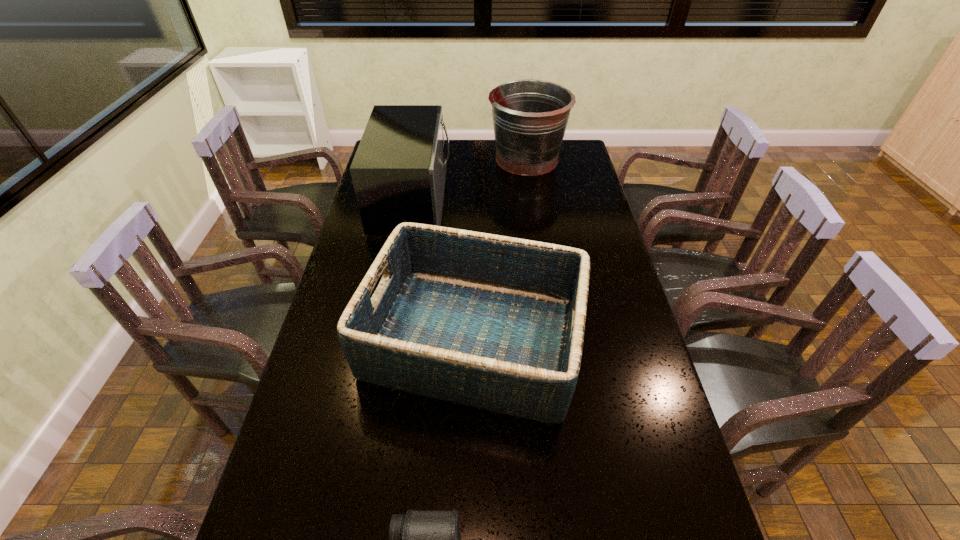
I want to click on bucket, so click(530, 117).

At what (x,y) coordinates should I click in order to perform the action: click on microwave oven. Please return your answer as a coordinate pair (x, y). This screenshot has height=540, width=960. Looking at the image, I should click on (399, 169).

What are the coordinates of `the third tallest object` in the screenshot? It's located at (493, 322).

Find the location of `the third farthest object`. the third farthest object is located at coordinates (493, 322).

Identify the location of vacant region located 0.310m on the left of the bucket. The height and width of the screenshot is (540, 960). (417, 159).

The height and width of the screenshot is (540, 960). In order to click on vacant space located with the door open on the microwave oven in this screenshot , I will do `click(477, 200)`.

I want to click on vacant space located on the back of the basket, so click(475, 254).

I want to click on object that is at the far edge, so click(530, 117).

You are a GUI agent. You are given a task and a screenshot of the screen. Output one action in this format:
    pyautogui.click(x=<x>, y=<y>)
    Task: Click on the microwave oven present at the left edge
    This screenshot has width=960, height=540.
    Given the screenshot: What is the action you would take?
    pyautogui.click(x=399, y=169)

Locate an element on the screen. Image resolution: width=960 pixels, height=540 pixels. basket that is positioned at the left edge is located at coordinates (493, 322).